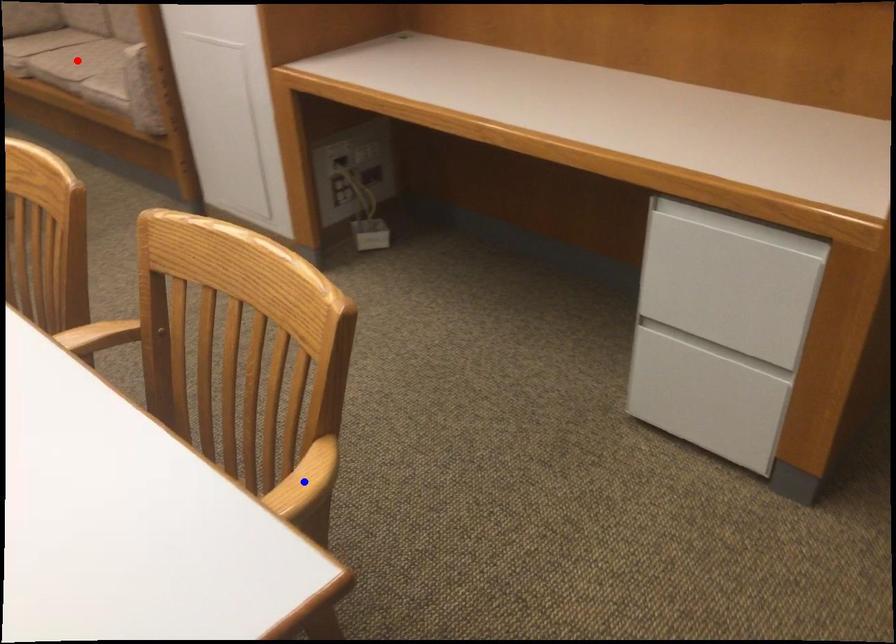
Question: In the image, two points are highlighted. Which point is nearer to the camera? Reply with the corresponding letter.

Choices:
 (A) blue point
 (B) red point

Answer: (A)